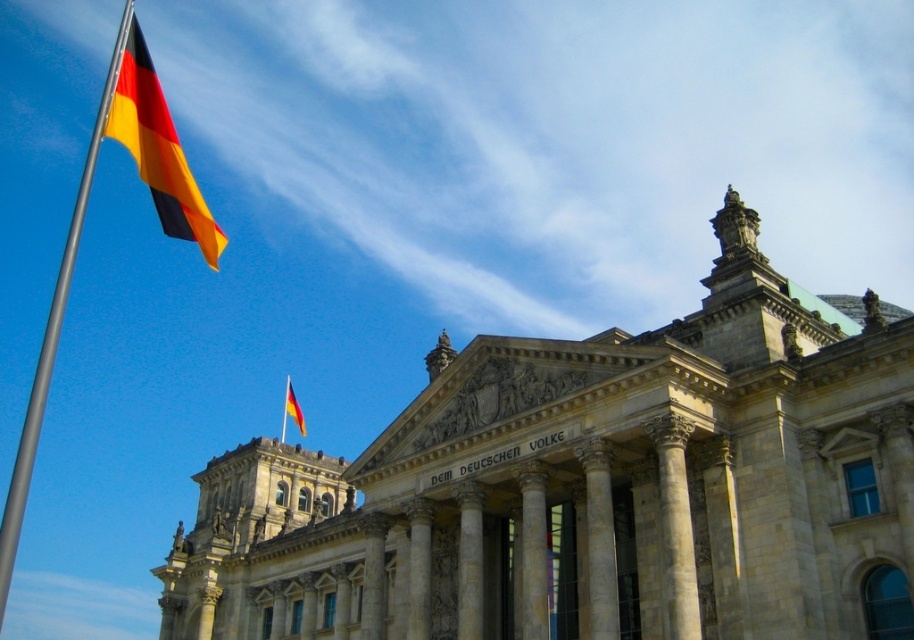
Is polished fabric flag at upper left below metallic pole at left?

Incorrect, polished fabric flag at upper left is not positioned below metallic pole at left.

Between polished fabric flag at upper left and metallic pole at left, which one is positioned lower?

Positioned lower is metallic pole at left.

Is point (137, 120) positioned behind point (30, 458)?

No, (137, 120) is closer to viewer.

Locate an element on the screen. Image resolution: width=914 pixels, height=640 pixels. polished fabric flag at upper left is located at coordinates (157, 147).

What do you see at coordinates (157, 147) in the screenshot?
I see `polished fabric flag at upper left` at bounding box center [157, 147].

Locate an element on the screen. This screenshot has width=914, height=640. polished fabric flag at upper left is located at coordinates (157, 147).

Does metallic pole at left appear on the right side of matte fabric flag at upper left?

Incorrect, metallic pole at left is not on the right side of matte fabric flag at upper left.

Does metallic pole at left appear over matte fabric flag at upper left?

Correct, metallic pole at left is located above matte fabric flag at upper left.

The width and height of the screenshot is (914, 640). Find the location of `metallic pole at left`. metallic pole at left is located at coordinates (52, 336).